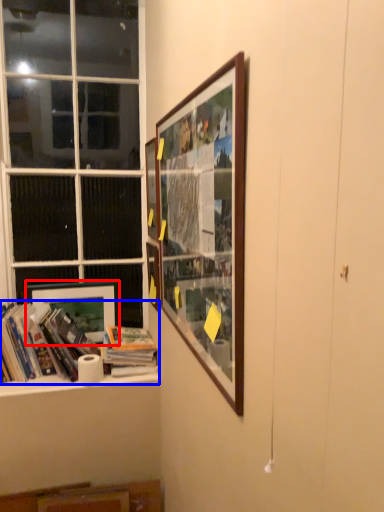
Question: Among these objects, which one is nearest to the camera, picture frame (highlighted by a red box) or book (highlighted by a blue box)?

Choices:
 (A) picture frame
 (B) book

Answer: (B)